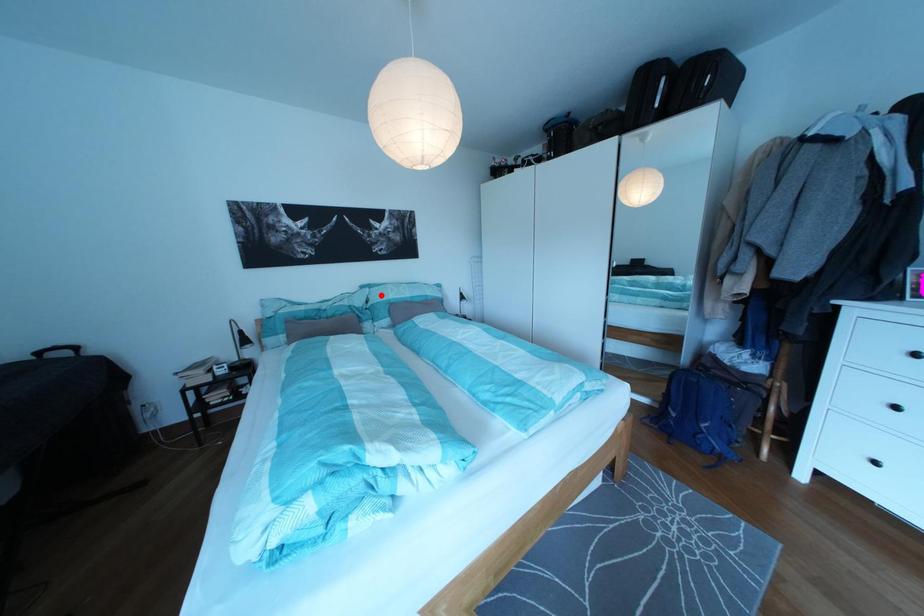
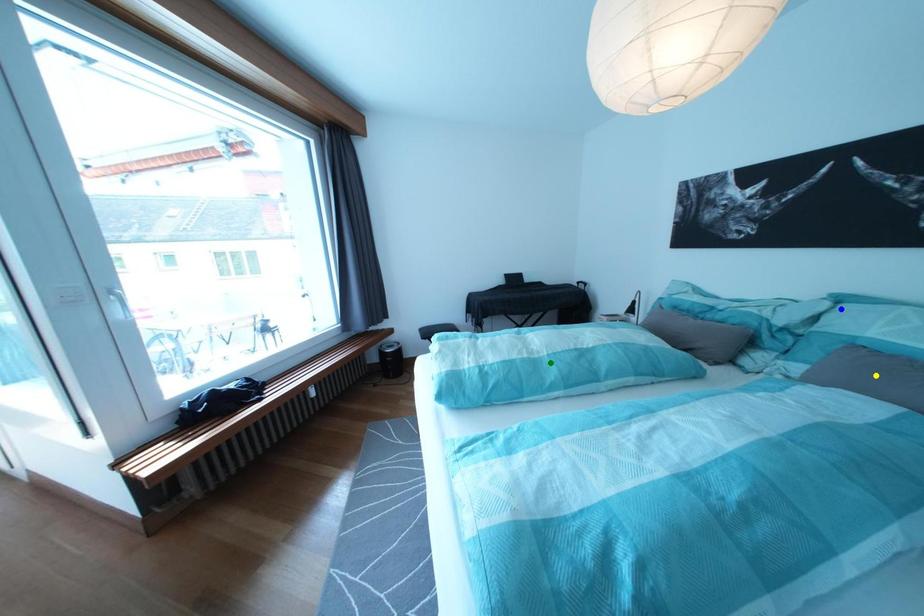
Question: I am providing you with two images of the same scene from different viewpoints. A red point is marked on the first image. You are given multiple points on the second image. Which point in image 2 is actually the same real-world point as the red point in image 1?

Choices:
 (A) yellow point
 (B) green point
 (C) blue point

Answer: (C)